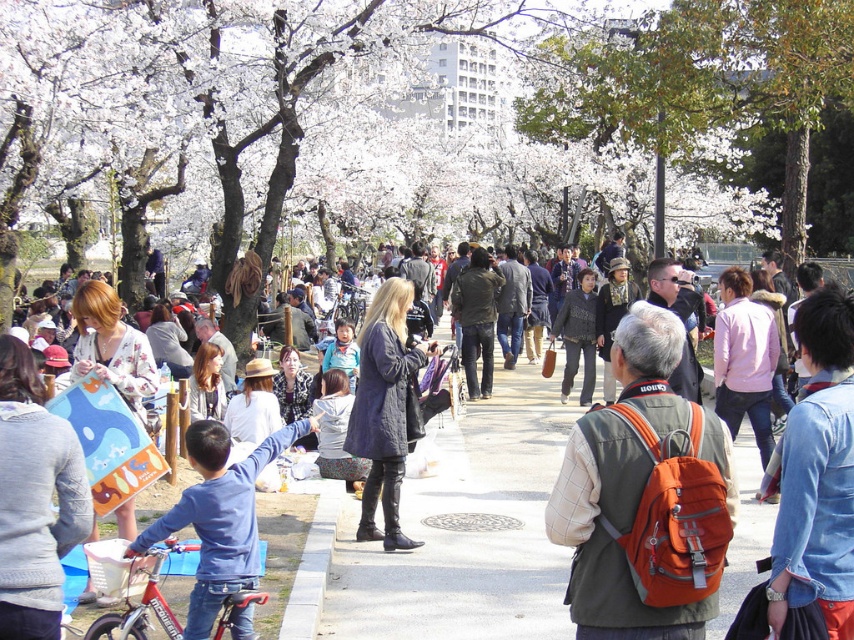
Can you confirm if orange fabric backpack at center is wider than pink fabric jacket at center-right?

Correct, the width of orange fabric backpack at center exceeds that of pink fabric jacket at center-right.

Is orange fabric backpack at center bigger than pink fabric jacket at center-right?

Yes.

Describe the element at coordinates (644, 497) in the screenshot. I see `orange fabric backpack at center` at that location.

You are a GUI agent. You are given a task and a screenshot of the screen. Output one action in this format:
    pyautogui.click(x=<x>, y=<y>)
    Task: Click on the orange fabric backpack at center
    The height and width of the screenshot is (640, 854).
    Given the screenshot: What is the action you would take?
    pyautogui.click(x=644, y=497)

Based on the photo, can you confirm if denim shirt at center right is positioned below knitted gray sweater at lower left?

Actually, denim shirt at center right is above knitted gray sweater at lower left.

Does denim shirt at center right have a greater width compared to knitted gray sweater at lower left?

Yes, denim shirt at center right is wider than knitted gray sweater at lower left.

Does point (790, 419) come farther from viewer compared to point (16, 516)?

That is True.

Identify the location of denim shirt at center right. This screenshot has width=854, height=640. (816, 474).

Between blue denim jeans at lower left and pink fabric jacket at center-right, which one has less height?

With less height is pink fabric jacket at center-right.

Is point (227, 570) positioned in front of point (743, 372)?

Yes, it is.

Describe the element at coordinates (219, 516) in the screenshot. The width and height of the screenshot is (854, 640). I see `blue denim jeans at lower left` at that location.

You are a GUI agent. You are given a task and a screenshot of the screen. Output one action in this format:
    pyautogui.click(x=<x>, y=<y>)
    Task: Click on the blue denim jeans at lower left
    This screenshot has width=854, height=640.
    Given the screenshot: What is the action you would take?
    pyautogui.click(x=219, y=516)